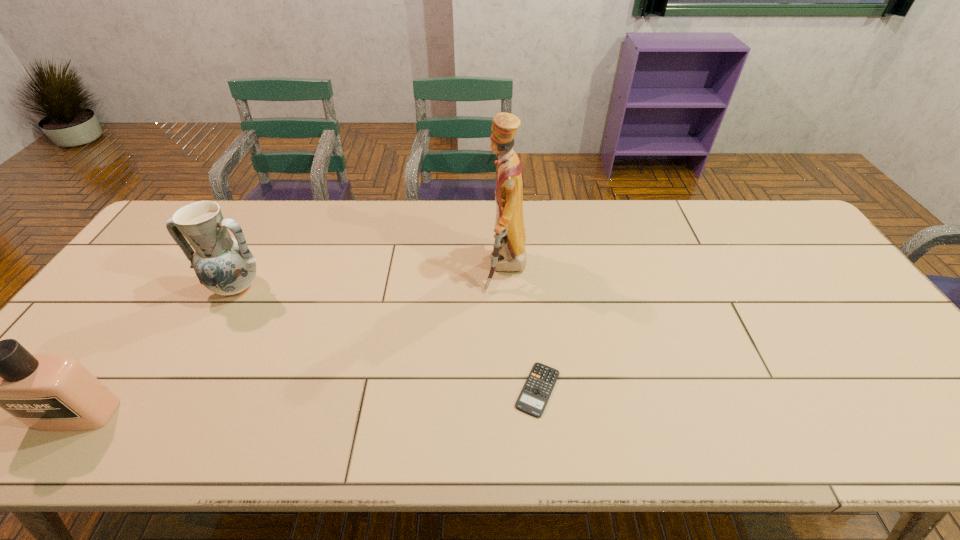
Locate an element on the screen. free point between the shortest object and the leftmost object is located at coordinates (307, 402).

At what (x,y) coordinates should I click in order to perform the action: click on vacant space that's between the second object from left to right and the nutcracker. Please return your answer as a coordinate pair (x, y). Looking at the image, I should click on (371, 278).

Where is `vacant region between the third object from right to left and the shortest object`? vacant region between the third object from right to left and the shortest object is located at coordinates (387, 338).

At what (x,y) coordinates should I click in order to perform the action: click on vacant space that is in between the tallest object and the leftmost object. Please return your answer as a coordinate pair (x, y). This screenshot has width=960, height=540. Looking at the image, I should click on (291, 341).

Locate an element on the screen. This screenshot has height=540, width=960. vacant area between the pottery and the leftmost object is located at coordinates (156, 350).

Image resolution: width=960 pixels, height=540 pixels. Identify the location of free point between the second object from left to right and the leftmost object. (156, 350).

Identify the location of free space between the third object from right to left and the calculator. (387, 338).

This screenshot has width=960, height=540. In order to click on empty location between the perfume and the shortest object in this screenshot , I will do `click(307, 402)`.

I want to click on object that can be found as the third closest to the calculator, so click(47, 392).

Where is `object that ranks as the second closest to the pottery`? This screenshot has height=540, width=960. object that ranks as the second closest to the pottery is located at coordinates (509, 255).